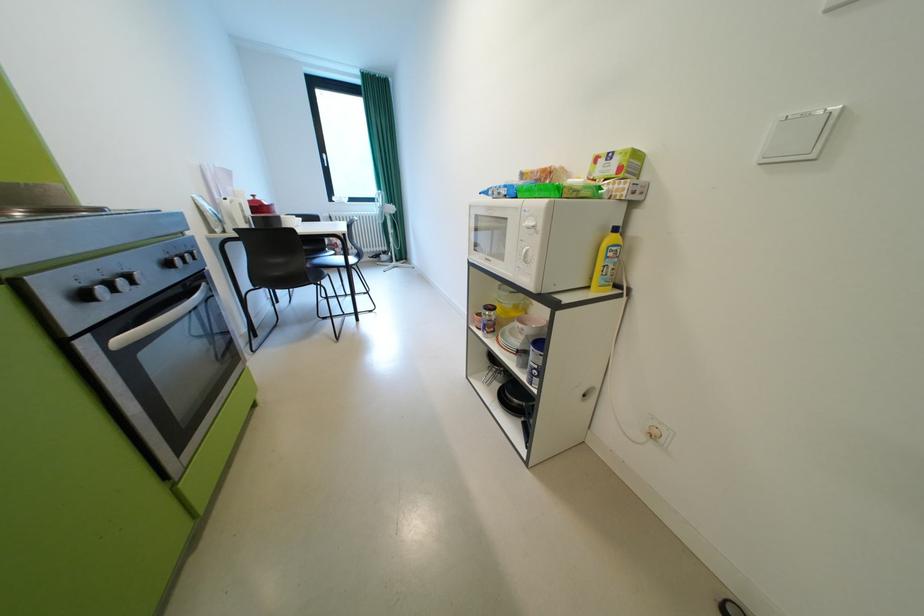
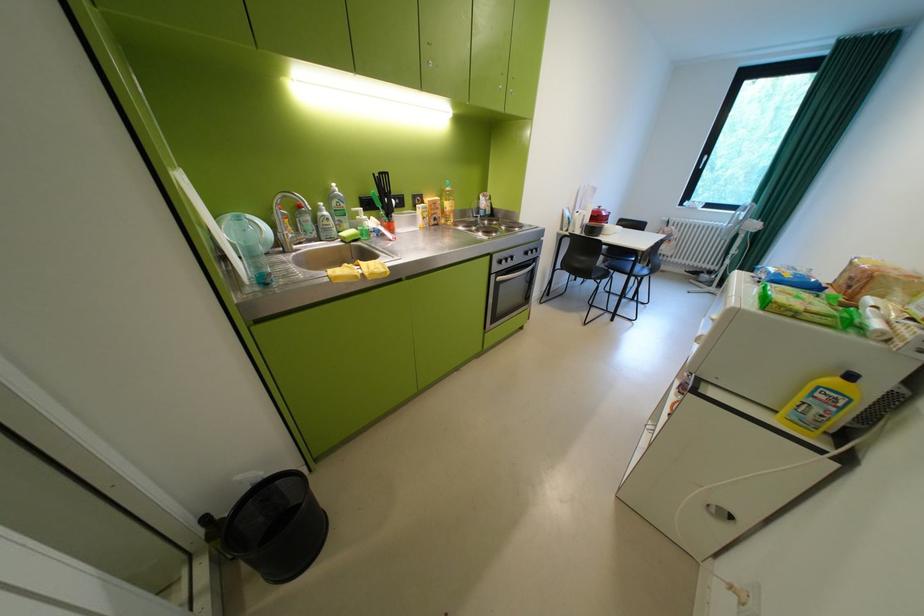
Find the pixel in the second image that matches point (621, 254) in the first image.

(830, 395)